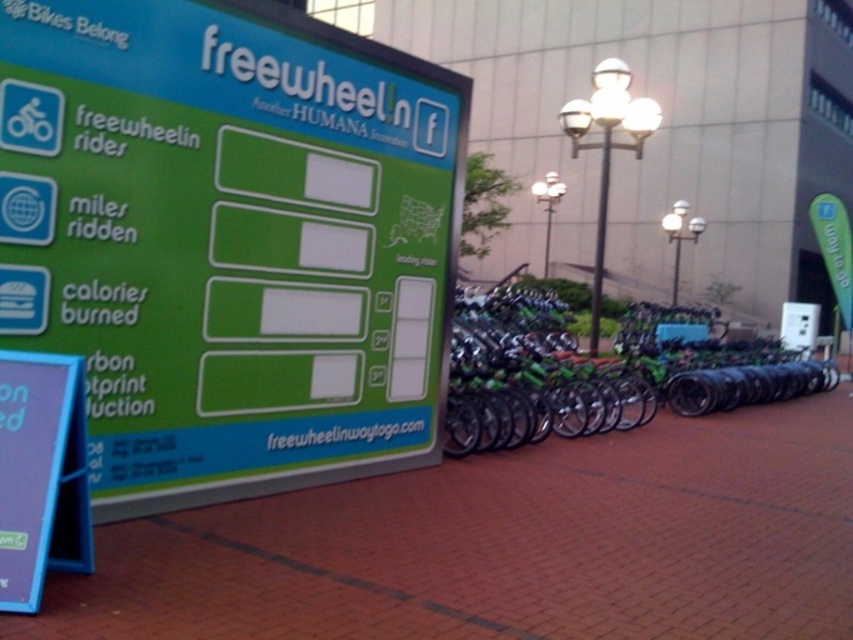
You are a city planner reviewing the placement of the green matte sign at upper left and the blue plastic sign at lower left. Which sign is positioned higher up in the image?

The green matte sign at upper left is positioned higher up in the image than the blue plastic sign at lower left.

From the picture: You are a city planner analyzing the placement of two signs in a public area. The green matte sign at upper left and the blue plastic sign at lower left are both part of a bike promotion campaign. Which sign is taller?

The green matte sign at upper left is taller than the blue plastic sign at lower left according to the description provided.

You are a delivery person who needs to pick up a bike for a quick delivery. The signboard says the bike is located at coordinates 0.581, 0.701. Where should you look to find the green matte bicycle at center?

The green matte bicycle at center is located at point (596, 371), so you should look there to find it.